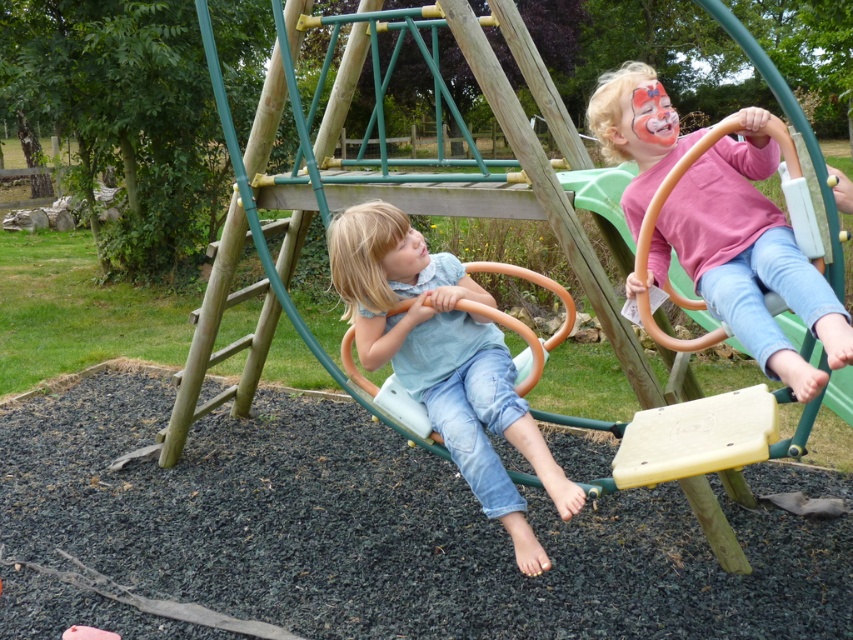
You are a photographer taking a picture of the two girls at the playground. You notice the pink matte shirt at upper right and the smooth skin face at center. Which object should you focus on if you want to capture the wider one in your shot?

The pink matte shirt at upper right is wider than the smooth skin face at center, so you should focus on the pink matte shirt at upper right to capture the wider object.

You are a photographer taking a photo of the two girls at the playground. You notice the matte pink face paint at upper right and the smooth skin face at center. Which object should you focus on if you want to capture the one that is higher in the frame?

The matte pink face paint at upper right is much taller than the smooth skin face at center, so you should focus on the matte pink face paint at upper right to capture the higher one.

Based on the coordinates provided in the scene description, where is the pink matte shirt at upper right located?

The pink matte shirt at upper right is located at point (747, 257).